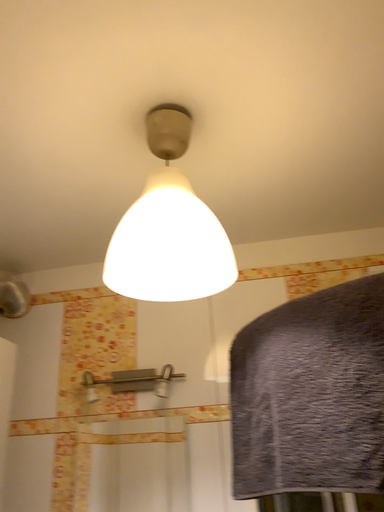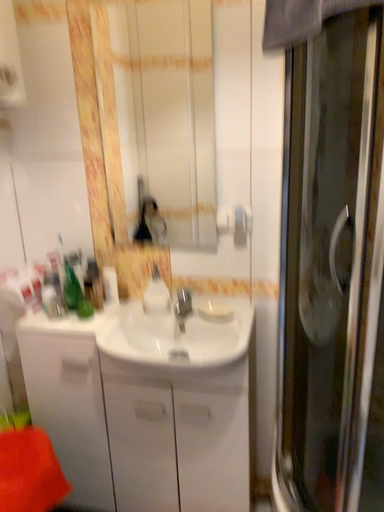
Question: How did the camera likely rotate when shooting the video?

Choices:
 (A) rotated upward
 (B) rotated downward

Answer: (B)